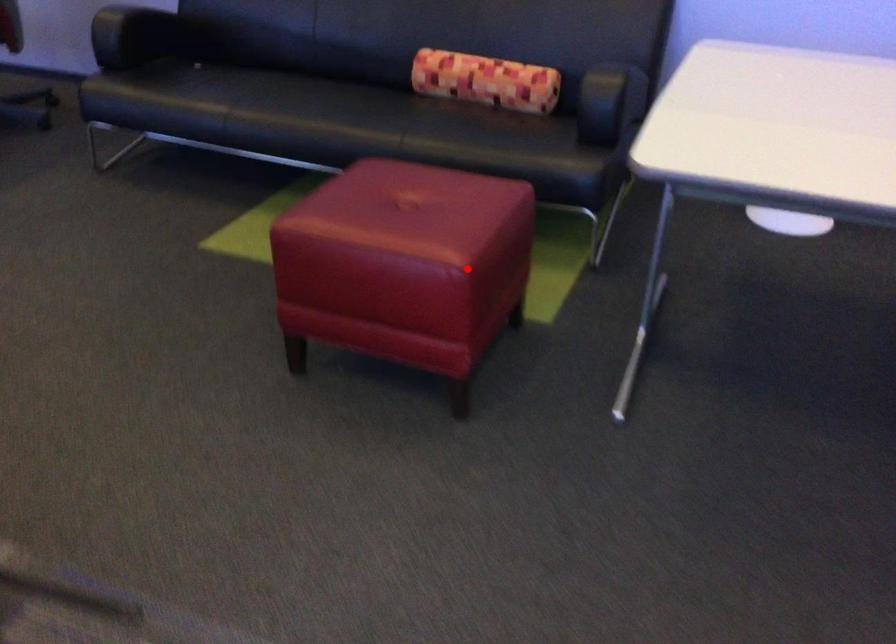
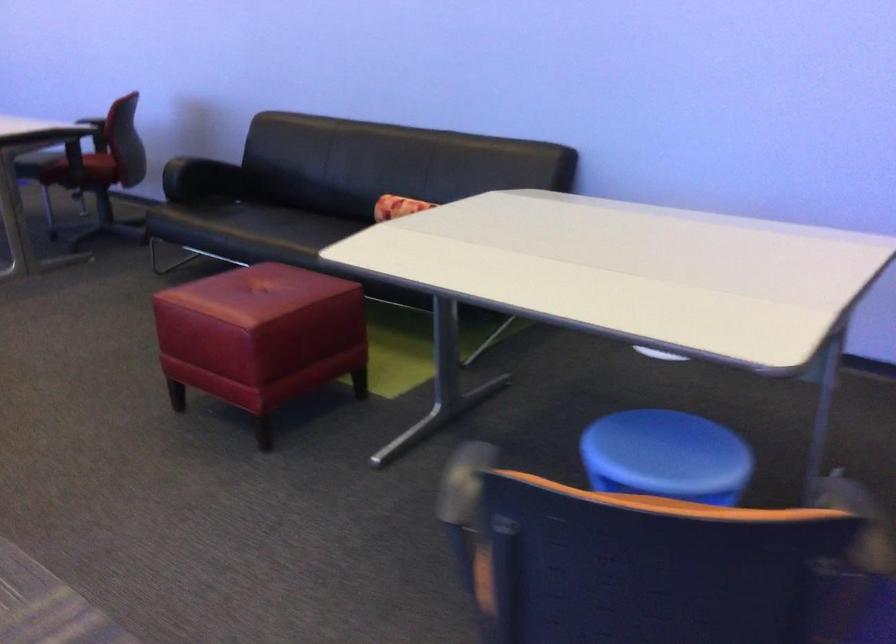
Question: I am providing you with two images of the same scene from different viewpoints. A red point is marked on the first image. At the location where the point appears in image 1, is it still visible in image 2?

Choices:
 (A) Yes
 (B) No

Answer: (A)